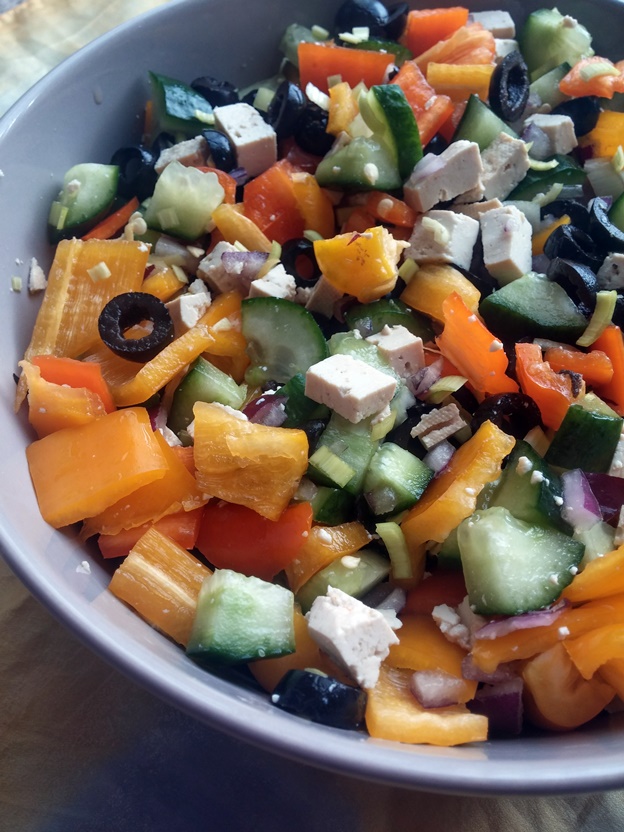
Find the location of a particular element. left bottom arc of white bowl edge is located at coordinates (80, 595), (149, 650), (271, 743).